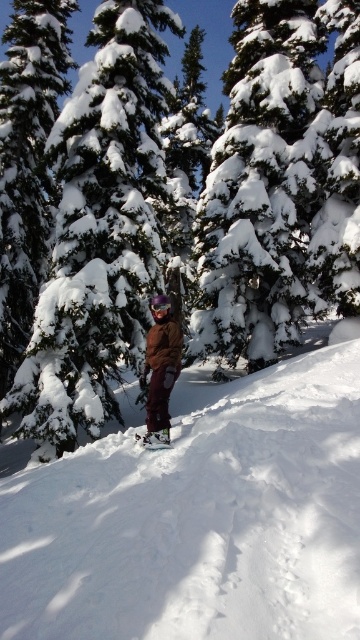
Question: Which of the following is the farthest from the observer?

Choices:
 (A) (240, 76)
 (B) (324, 588)

Answer: (A)

Question: Which of the following is the closest to the observer?

Choices:
 (A) matte brown jacket at center
 (B) green matte snow at center
 (C) black matte snowboard at center

Answer: (A)

Question: Which point appears farthest from the camera in this image?

Choices:
 (A) (141, 440)
 (B) (308, 209)

Answer: (B)

Question: Can you confirm if white powdery snow at center is smaller than snow-covered evergreen tree at upper center?

Choices:
 (A) yes
 (B) no

Answer: (A)

Question: Can you confirm if green matte snow at center is positioned above black matte snowboard at center?

Choices:
 (A) yes
 (B) no

Answer: (A)

Question: Can you confirm if white powdery snow at center is thinner than snow-covered evergreen tree at left?

Choices:
 (A) no
 (B) yes

Answer: (B)